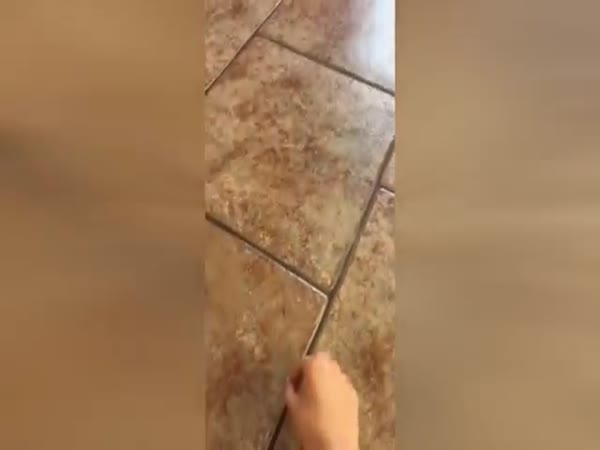
Where is `black grout`? This screenshot has height=450, width=600. black grout is located at coordinates (331, 292), (281, 263), (225, 70), (322, 59), (385, 154), (386, 189), (368, 207), (311, 345).